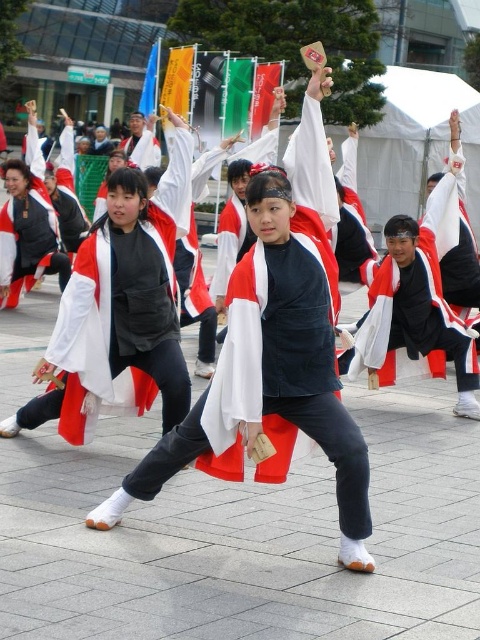
You are a photographer positioned in front of the group of dancers. You want to take a photo focusing on the white matte kimono at center and the matte black jacket at center. Based on their positions, which one should you adjust your camera to capture first if you are moving from left to right across the scene?

The white matte kimono at center should be captured first because the matte black jacket at center is positioned to its right. Since you are moving from left to right, you would encounter the white matte kimono at center before the matte black jacket at center.

You are a photographer trying to capture a photo of the matte black jacket at center and the white matte kimono at center. If you want to ensure both are fully visible in the frame, which object should you focus on to avoid cropping either?

You should focus on the matte black jacket at center since it might be wider than the white matte kimono at center, so centering the wider object increases the likelihood that both will fit in the frame without cropping.

You are a photographer standing at the edge of the plaza. You want to capture a photo of the two performers wearing the matte black jacket at center and the white matte kimono at center. Given that your camera has a maximum focus range of 4 feet, can you ensure both are in focus without moving closer?

The matte black jacket at center is 4.06 feet from the white matte kimono at center. Since the distance between them exceeds the camera maximum focus range of 4 feet, you cannot ensure both are in focus without moving closer.